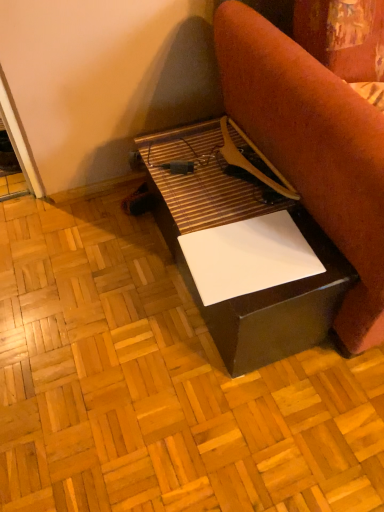
In order to click on free space in front of matte black table at center in this screenshot , I will do [211, 419].